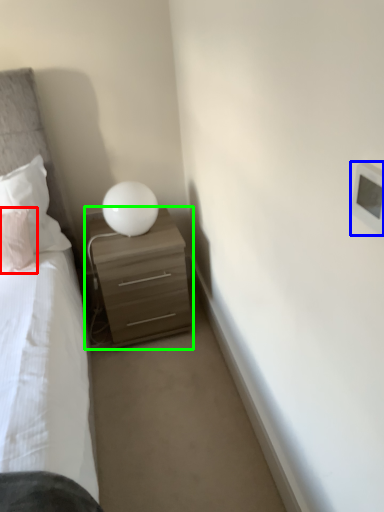
Question: Estimate the real-world distances between objects in this image. Which object is farther from pillow (highlighted by a red box), light switch (highlighted by a blue box) or nightstand (highlighted by a green box)?

Choices:
 (A) light switch
 (B) nightstand

Answer: (A)